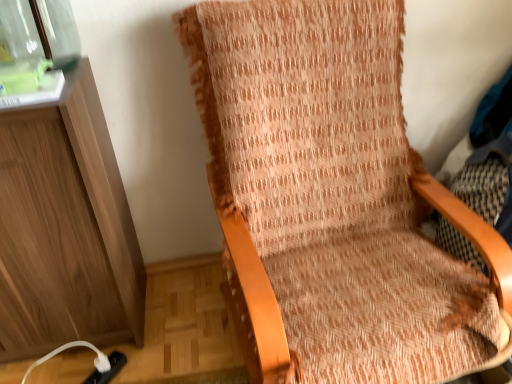
This screenshot has height=384, width=512. What are the coordinates of `transparent glass jar at upper left` in the screenshot? It's located at (35, 42).

What do you see at coordinates (35, 42) in the screenshot?
I see `transparent glass jar at upper left` at bounding box center [35, 42].

In order to face transparent glass jar at upper left, should I rotate leftwards or rightwards?

Rotate your view left by about 26.410°.

The image size is (512, 384). Describe the element at coordinates (327, 196) in the screenshot. I see `textured orange fabric chair at center` at that location.

I want to click on textured orange fabric chair at center, so click(x=327, y=196).

Measure the distance between textured orange fabric chair at center and camera.

textured orange fabric chair at center is 34.90 inches away from camera.

The width and height of the screenshot is (512, 384). Find the location of `transparent glass jar at upper left`. transparent glass jar at upper left is located at coordinates (35, 42).

Does textured orange fabric chair at center appear on the right side of transparent glass jar at upper left?

Indeed, textured orange fabric chair at center is positioned on the right side of transparent glass jar at upper left.

Between textured orange fabric chair at center and transparent glass jar at upper left, which one is positioned in front?

textured orange fabric chair at center is closer to the camera.

Which is less distant, (229, 15) or (64, 24)?

The point (229, 15) is closer.

From the image's perspective, is textured orange fabric chair at center located beneath transparent glass jar at upper left?

Yes, from the image's perspective, textured orange fabric chair at center is below transparent glass jar at upper left.

From a real-world perspective, which object rests below the other?

textured orange fabric chair at center, from a real-world perspective.

Consider the image. Between textured orange fabric chair at center and transparent glass jar at upper left, which one has larger width?

textured orange fabric chair at center.

Who is shorter, textured orange fabric chair at center or transparent glass jar at upper left?

transparent glass jar at upper left.

Between textured orange fabric chair at center and transparent glass jar at upper left, which one has larger size?

textured orange fabric chair at center.

Is transparent glass jar at upper left a part of textured orange fabric chair at center?

No, transparent glass jar at upper left is not surrounded by textured orange fabric chair at center.

Is textured orange fabric chair at center positioned far away from transparent glass jar at upper left?

No, textured orange fabric chair at center is in close proximity to transparent glass jar at upper left.

Could you tell me if textured orange fabric chair at center is turned towards transparent glass jar at upper left?

No, textured orange fabric chair at center is not oriented towards transparent glass jar at upper left.

Can you tell me how much textured orange fabric chair at center and transparent glass jar at upper left differ in facing direction?

5.49 degrees separate the facing orientations of textured orange fabric chair at center and transparent glass jar at upper left.

This screenshot has width=512, height=384. I want to click on chair that is under the transparent glass jar at upper left (from a real-world perspective), so click(327, 196).

Which is more to the right, transparent glass jar at upper left or textured orange fabric chair at center?

Positioned to the right is textured orange fabric chair at center.

In the image, is transparent glass jar at upper left positioned in front of or behind textured orange fabric chair at center?

Clearly, transparent glass jar at upper left is behind textured orange fabric chair at center.

Which point is more distant from viewer, (71, 40) or (275, 207)?

The point (275, 207) is more distant.

Based on the photo, from the image's perspective, between transparent glass jar at upper left and textured orange fabric chair at center, which one is located above?

transparent glass jar at upper left, from the image's perspective.

Looking at this image, from a real-world perspective, is transparent glass jar at upper left over textured orange fabric chair at center?

Yes, from a real-world perspective, transparent glass jar at upper left is on top of textured orange fabric chair at center.

Can you confirm if transparent glass jar at upper left is thinner than textured orange fabric chair at center?

Indeed, transparent glass jar at upper left has a lesser width compared to textured orange fabric chair at center.

Which of these two, transparent glass jar at upper left or textured orange fabric chair at center, stands taller?

textured orange fabric chair at center is taller.

Considering the relative sizes of transparent glass jar at upper left and textured orange fabric chair at center in the image provided, is transparent glass jar at upper left smaller than textured orange fabric chair at center?

Indeed, transparent glass jar at upper left has a smaller size compared to textured orange fabric chair at center.

Could textured orange fabric chair at center be considered to be inside transparent glass jar at upper left?

No, textured orange fabric chair at center is not a part of transparent glass jar at upper left.

Is transparent glass jar at upper left in contact with textured orange fabric chair at center?

transparent glass jar at upper left and textured orange fabric chair at center are not in contact.

Is transparent glass jar at upper left facing away from textured orange fabric chair at center?

transparent glass jar at upper left does not have its back to textured orange fabric chair at center.

Where is `chair on the right of transparent glass jar at upper left`? The image size is (512, 384). chair on the right of transparent glass jar at upper left is located at coordinates (327, 196).

Find the location of a particular element. The height and width of the screenshot is (384, 512). chair below the transparent glass jar at upper left (from the image's perspective) is located at coordinates (327, 196).

The image size is (512, 384). What are the coordinates of `chair below the transparent glass jar at upper left (from a real-world perspective)` in the screenshot? It's located at (327, 196).